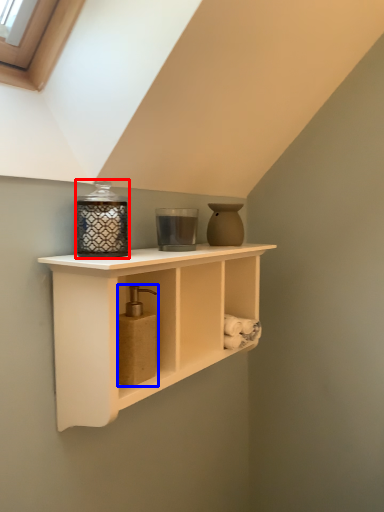
Question: Which object is closer to the camera taking this photo, candle holder (highlighted by a red box) or soap dispenser (highlighted by a blue box)?

Choices:
 (A) candle holder
 (B) soap dispenser

Answer: (A)